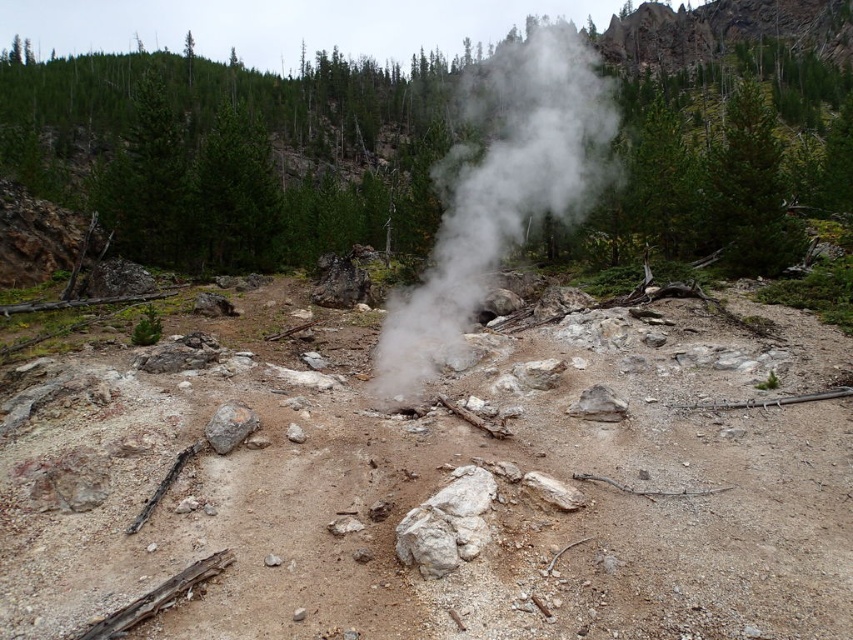
Does rusty metallic rock at center have a greater height compared to gray rough rock at center?

Indeed, rusty metallic rock at center has a greater height compared to gray rough rock at center.

Is rusty metallic rock at center to the left of gray rough rock at center from the viewer's perspective?

Yes, rusty metallic rock at center is to the left of gray rough rock at center.

Where is `rusty metallic rock at center`? rusty metallic rock at center is located at coordinates (229, 426).

Locate an element on the screen. The width and height of the screenshot is (853, 640). rusty metallic rock at center is located at coordinates (229, 426).

From the picture: Who is lower down, brown sandy dirt track at center or white vapor at center?

brown sandy dirt track at center is lower down.

Is brown sandy dirt track at center below white vapor at center?

Yes.

Identify the location of brown sandy dirt track at center. The height and width of the screenshot is (640, 853). (440, 492).

Locate an element on the screen. This screenshot has width=853, height=640. brown sandy dirt track at center is located at coordinates (440, 492).

This screenshot has width=853, height=640. What do you see at coordinates (500, 195) in the screenshot? I see `white vapor at center` at bounding box center [500, 195].

Is white vapor at center positioned behind rusty metallic rock at center?

Yes, it is.

Is point (393, 356) less distant than point (229, 444)?

No, it is behind (229, 444).

Identify the location of white vapor at center. The height and width of the screenshot is (640, 853). (500, 195).